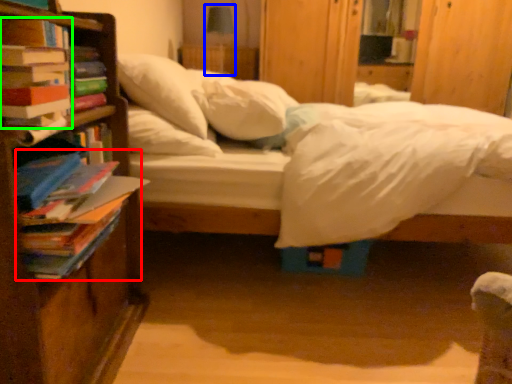
Question: Which object is positioned closest to book (highlighted by a red box)? Select from table lamp (highlighted by a blue box) and book (highlighted by a green box).

Choices:
 (A) table lamp
 (B) book

Answer: (B)